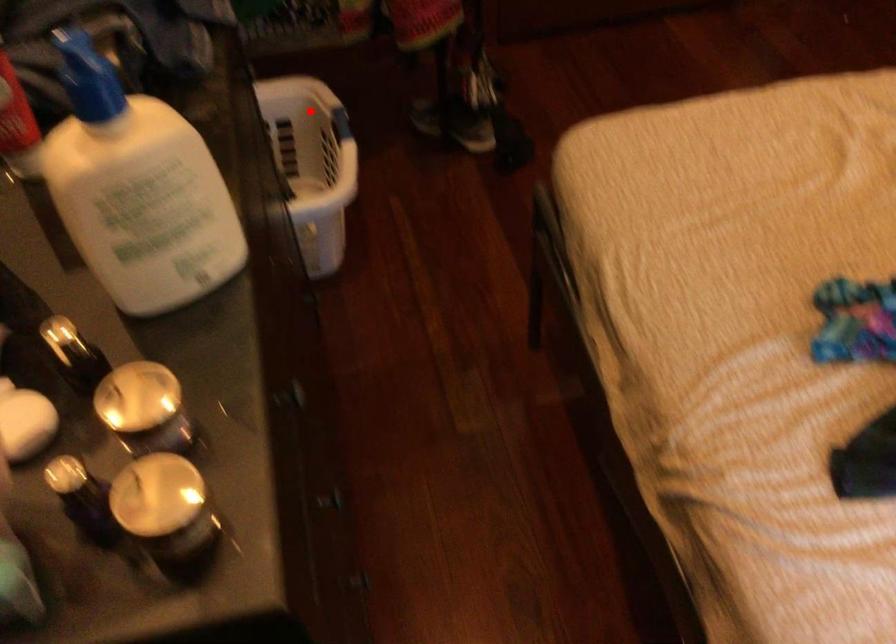
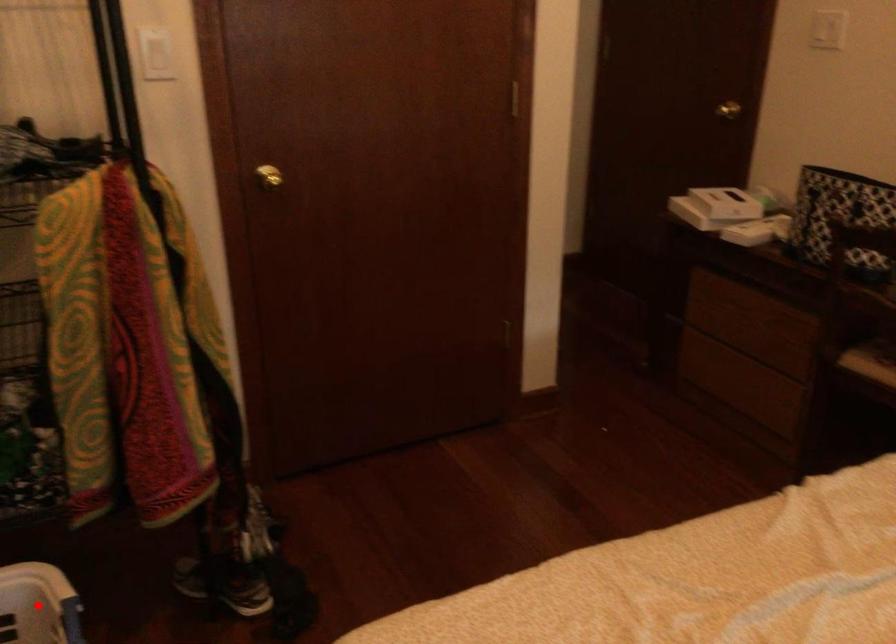
I am providing you with two images of the same scene from different viewpoints. A red point is marked on the first image and another point is marked on the second image. Does the point marked in image1 correspond to the same location as the one in image2?

Yes